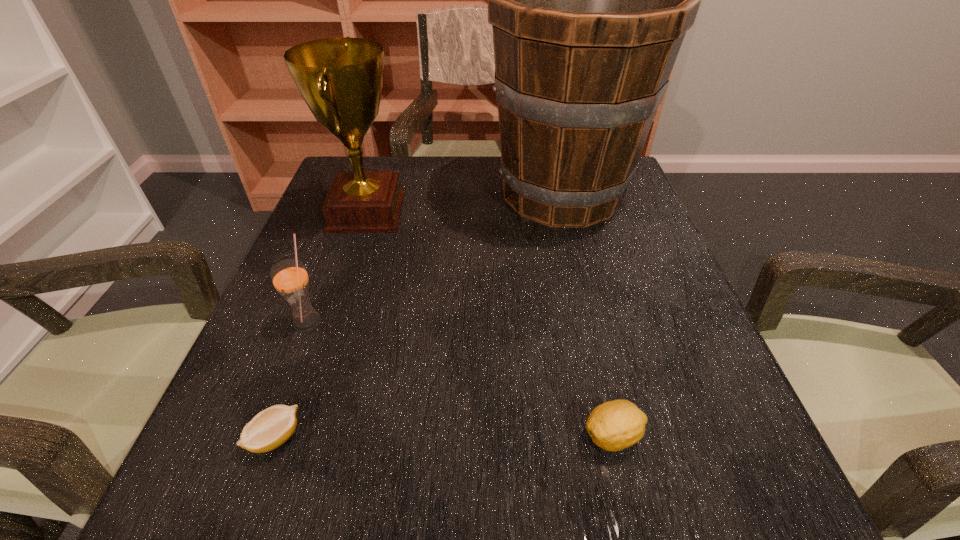
The height and width of the screenshot is (540, 960). What are the coordinates of `bucket positioned at the right edge` in the screenshot? It's located at (590, 0).

The width and height of the screenshot is (960, 540). I want to click on lemon that is at the right edge, so click(x=615, y=425).

This screenshot has width=960, height=540. I want to click on object present at the far left corner, so click(341, 79).

Find the location of `object that is at the near left corner`. object that is at the near left corner is located at coordinates click(x=269, y=429).

Locate an element on the screen. This screenshot has width=960, height=540. object that is positioned at the far right corner is located at coordinates (590, 0).

Where is `object that is at the near right corner`? object that is at the near right corner is located at coordinates (615, 425).

Locate an element on the screen. vacant region at the far edge of the desktop is located at coordinates coord(446,187).

At what (x,y) coordinates should I click in order to perform the action: click on vacant space at the near edge. Please return your answer as a coordinate pair (x, y). The height and width of the screenshot is (540, 960). Looking at the image, I should click on (419, 483).

In the image, there is a desktop. At what (x,y) coordinates should I click in order to perform the action: click on free region at the left edge. Please return your answer as a coordinate pair (x, y). The image size is (960, 540). Looking at the image, I should click on (314, 296).

Locate an element on the screen. Image resolution: width=960 pixels, height=540 pixels. free space at the right edge is located at coordinates (620, 209).